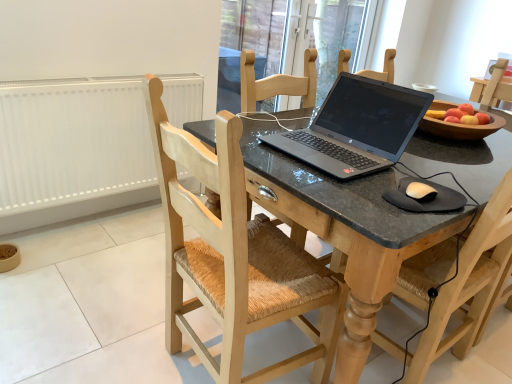
The image size is (512, 384). What are the coordinates of `free spot in front of white matte mouse at lower right` in the screenshot? It's located at (410, 221).